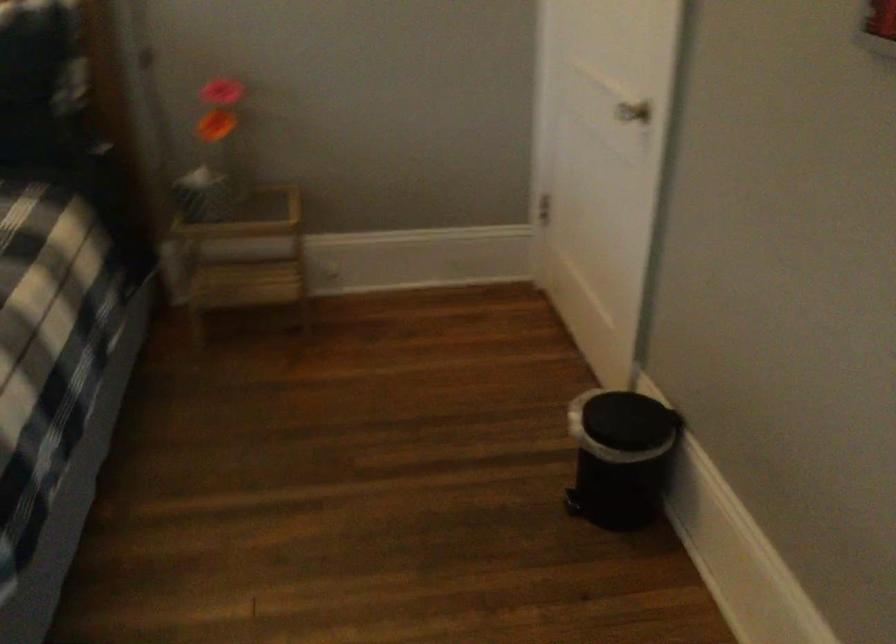
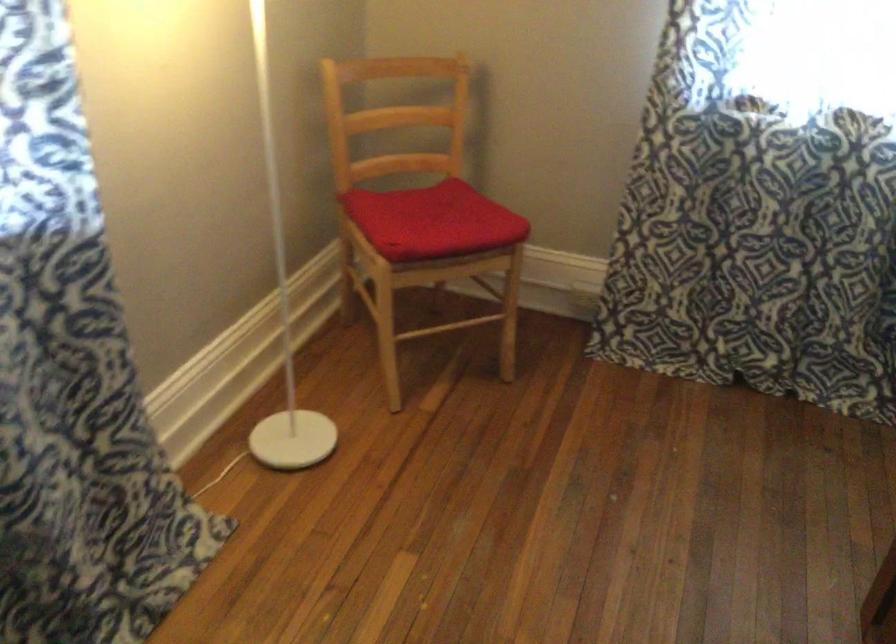
The images are taken continuously from a first-person perspective. In which direction is your viewpoint rotating?

The camera rotated toward left-down.